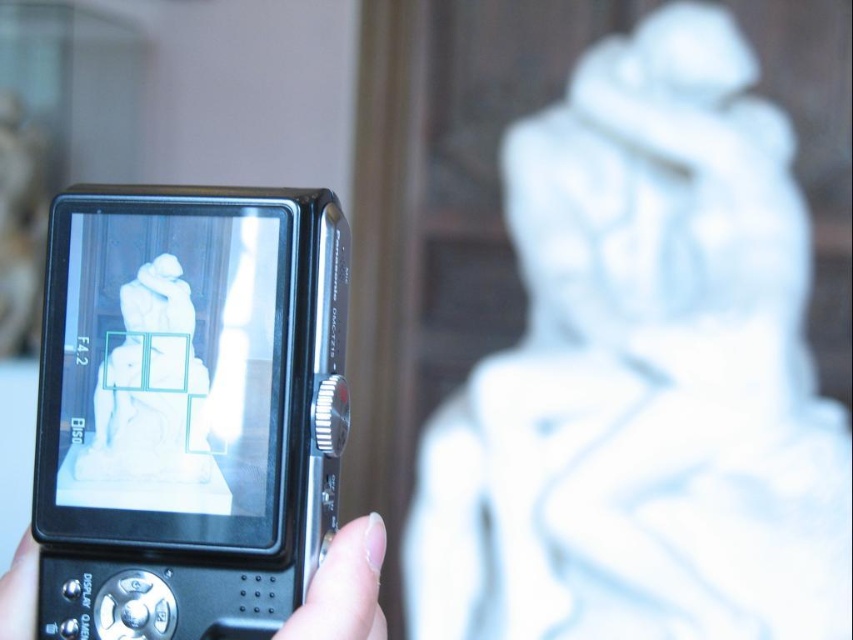
Question: Is white marble statue at center thinner than black plastic camera at center?

Choices:
 (A) no
 (B) yes

Answer: (A)

Question: Considering the real-world distances, which object is closest to the white marble statue at center?

Choices:
 (A) nail polish at lower center
 (B) black plastic camera at center

Answer: (B)

Question: Which of the following is the closest to the observer?

Choices:
 (A) (137, 636)
 (B) (364, 612)
 (C) (676, 225)

Answer: (B)

Question: Which object is closer to the camera taking this photo?

Choices:
 (A) nail polish at lower center
 (B) black plastic camera at center
 (C) white marble statue at center

Answer: (A)

Question: Can you confirm if white marble statue at center is bigger than black plastic camera at center?

Choices:
 (A) no
 (B) yes

Answer: (B)

Question: Is white marble statue at center positioned before black plastic camera at center?

Choices:
 (A) yes
 (B) no

Answer: (B)